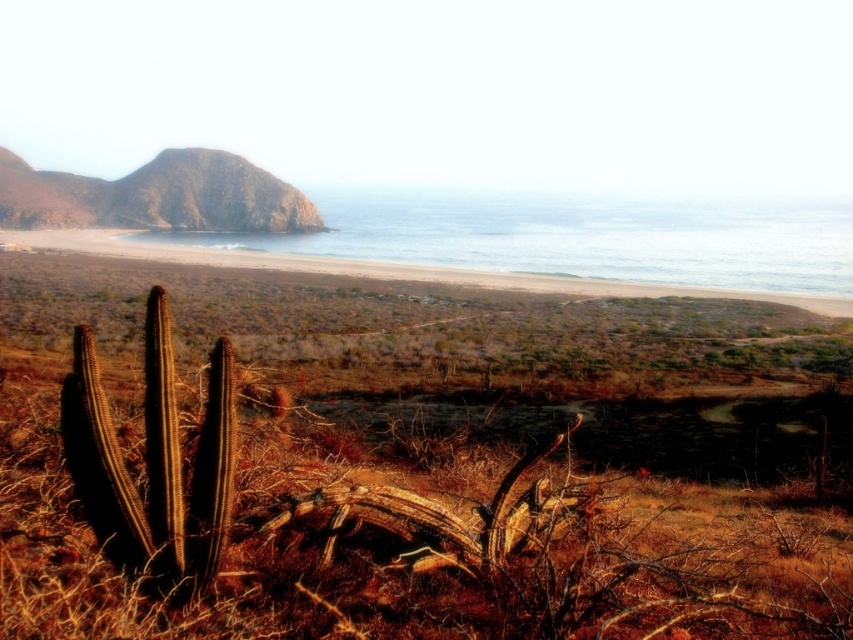
Question: In this image, where is clear blue water at upper center located relative to green mossy rock at upper left?

Choices:
 (A) above
 (B) below

Answer: (A)

Question: Is clear blue water at upper center smaller than green mossy rock at upper left?

Choices:
 (A) no
 (B) yes

Answer: (A)

Question: Among these points, which one is farthest from the camera?

Choices:
 (A) (109, 205)
 (B) (674, 276)

Answer: (A)

Question: Is clear blue water at upper center smaller than green mossy rock at upper left?

Choices:
 (A) no
 (B) yes

Answer: (A)

Question: Which point appears closest to the camera in this image?

Choices:
 (A) (286, 218)
 (B) (308, 237)

Answer: (B)